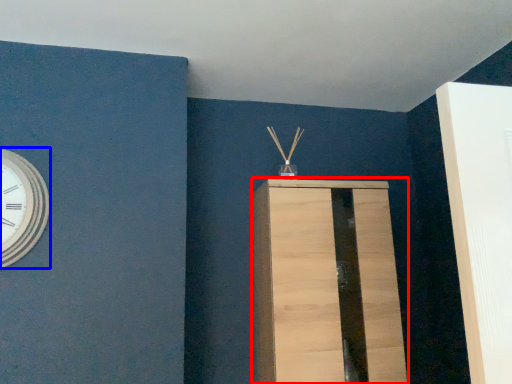
Question: Which point is closer to the camera, furniture (highlighted by a red box) or wall clock (highlighted by a blue box)?

Choices:
 (A) furniture
 (B) wall clock

Answer: (B)